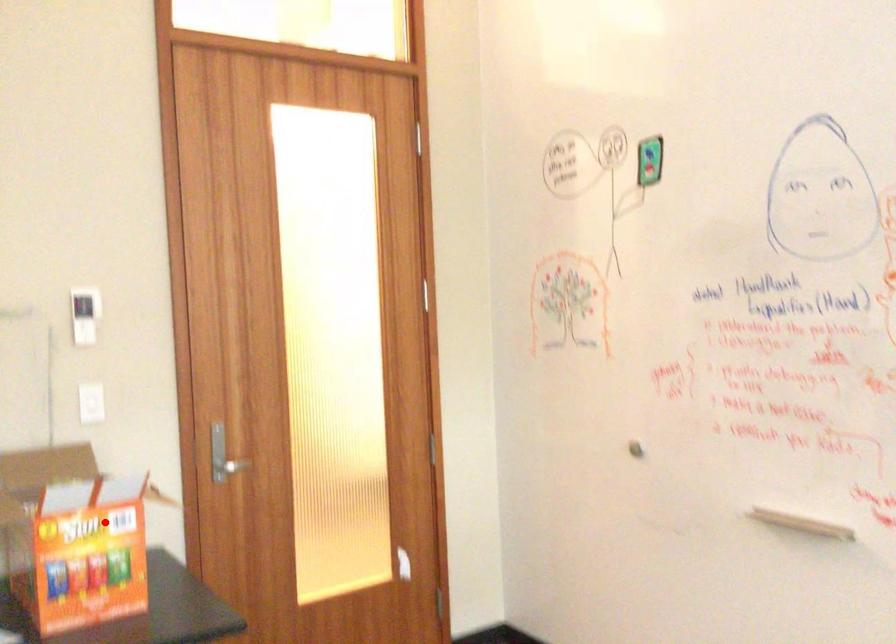
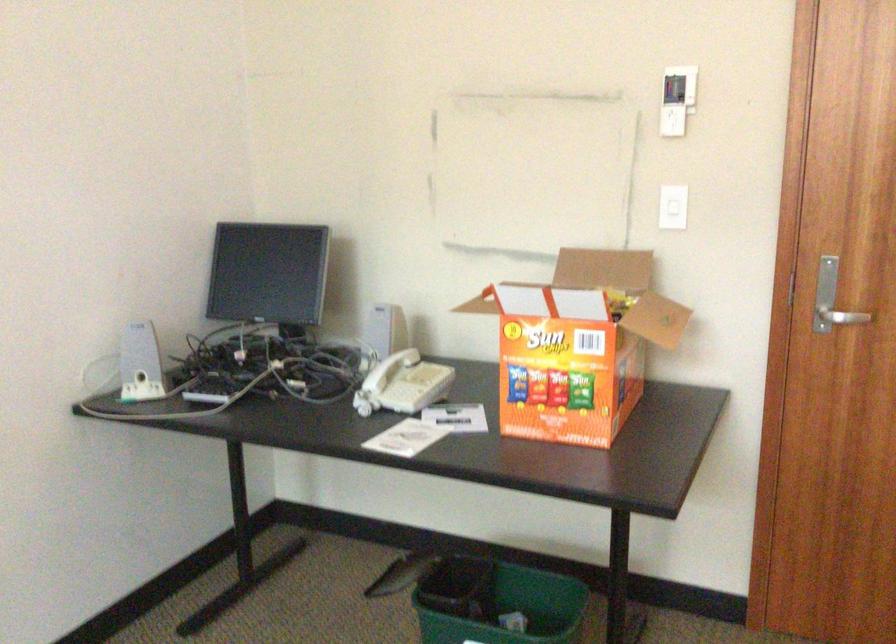
Find the pixel in the second image that matches the highlighted location in the first image.

(578, 345)